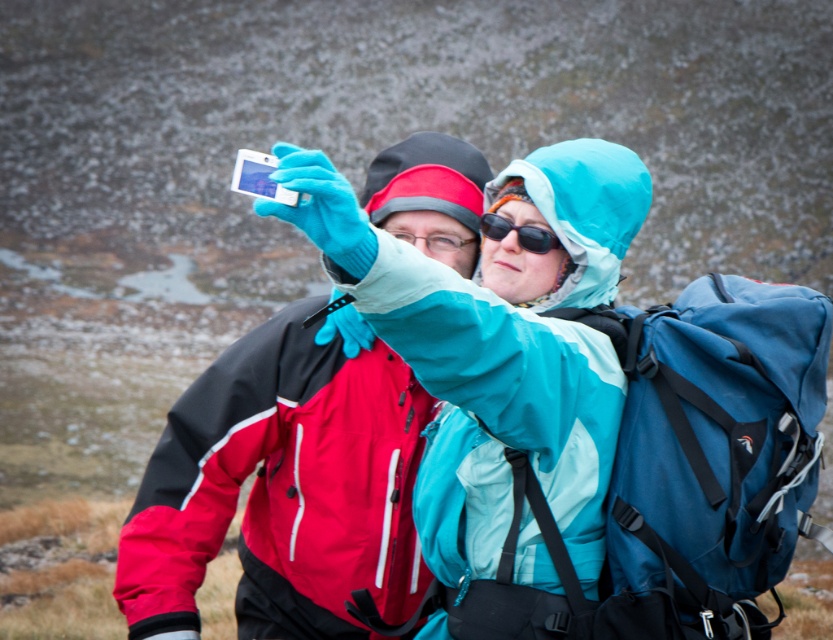
You are a photographer trying to capture a candid shot of the two hikers. You notice the matte blue jacket at center and the black plastic sunglasses at center. Which object should you focus on first if you want to capture the one that is lower in the frame?

The matte blue jacket at center is below the black plastic sunglasses at center, so you should focus on the matte blue jacket at center first to capture the lower object.